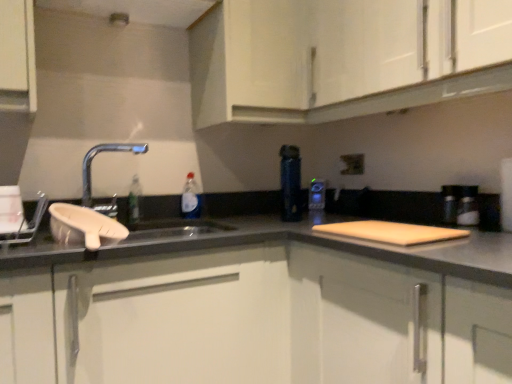
Question: Should I look upward or downward to see matte black electric outlet at upper center?

Choices:
 (A) down
 (B) up

Answer: (B)

Question: Considering the relative sizes of wooden cutting board at center, arranged as the 1th cabinetry when ordered from the bottom, and white matte cabinet at lower center, the second cabinetry viewed from the top, in the image provided, is wooden cutting board at center, arranged as the 1th cabinetry when ordered from the bottom, smaller than white matte cabinet at lower center, the second cabinetry viewed from the top,?

Choices:
 (A) yes
 (B) no

Answer: (B)

Question: Does wooden cutting board at center, arranged as the 3th cabinetry when viewed from the top, lie behind white matte cabinet at lower center, the second cabinetry viewed from the top?

Choices:
 (A) yes
 (B) no

Answer: (B)

Question: From the image's perspective, would you say wooden cutting board at center, arranged as the 3th cabinetry when viewed from the top, is positioned over white matte cabinet at lower center, the second cabinetry viewed from the top?

Choices:
 (A) no
 (B) yes

Answer: (A)

Question: Would you say white matte cabinet at lower center, acting as the 2th cabinetry starting from the bottom, is part of wooden cutting board at center, arranged as the 3th cabinetry when viewed from the top,'s contents?

Choices:
 (A) no
 (B) yes

Answer: (A)

Question: Considering the relative sizes of wooden cutting board at center, arranged as the 3th cabinetry when viewed from the top, and white matte cabinet at lower center, acting as the 2th cabinetry starting from the bottom, in the image provided, is wooden cutting board at center, arranged as the 3th cabinetry when viewed from the top, wider than white matte cabinet at lower center, acting as the 2th cabinetry starting from the bottom,?

Choices:
 (A) no
 (B) yes

Answer: (A)

Question: Could you tell me if wooden cutting board at center, arranged as the 1th cabinetry when ordered from the bottom, is turned towards white matte cabinet at lower center, acting as the 2th cabinetry starting from the bottom?

Choices:
 (A) no
 (B) yes

Answer: (B)

Question: Are blue glossy thermos at center and white matte cabinet at upper center, which is the 1th cabinetry in top-to-bottom order, far apart?

Choices:
 (A) yes
 (B) no

Answer: (B)

Question: Can you confirm if blue glossy thermos at center is bigger than white matte cabinet at upper center, which is the 1th cabinetry in top-to-bottom order?

Choices:
 (A) no
 (B) yes

Answer: (A)

Question: Is blue glossy thermos at center surrounding white matte cabinet at upper center, which is the 1th cabinetry in top-to-bottom order?

Choices:
 (A) no
 (B) yes

Answer: (A)

Question: Does blue glossy thermos at center have a lesser height compared to white matte cabinet at upper center, which is counted as the third cabinetry, starting from the bottom?

Choices:
 (A) yes
 (B) no

Answer: (A)

Question: Can you confirm if blue glossy thermos at center is thinner than white matte cabinet at upper center, which is counted as the third cabinetry, starting from the bottom?

Choices:
 (A) yes
 (B) no

Answer: (A)

Question: Is blue glossy thermos at center looking in the opposite direction of white matte cabinet at upper center, which is counted as the third cabinetry, starting from the bottom?

Choices:
 (A) yes
 (B) no

Answer: (B)

Question: From a real-world perspective, is matte black electric outlet at upper center on top of white matte cabinet at upper center, which is the 1th cabinetry in top-to-bottom order?

Choices:
 (A) no
 (B) yes

Answer: (A)